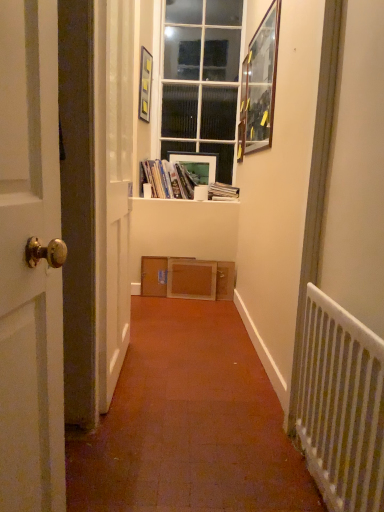
Question: Should I look upward or downward to see matte white picture frame at center, which ranks as the second picture frame in left-to-right order?

Choices:
 (A) up
 (B) down

Answer: (A)

Question: Considering the relative positions of hardcover book at center and wooden at center in the image provided, is hardcover book at center in front of wooden at center?

Choices:
 (A) yes
 (B) no

Answer: (B)

Question: Can you confirm if hardcover book at center is shorter than wooden at center?

Choices:
 (A) yes
 (B) no

Answer: (A)

Question: Does hardcover book at center have a greater height compared to wooden at center?

Choices:
 (A) yes
 (B) no

Answer: (B)

Question: Is hardcover book at center thinner than wooden at center?

Choices:
 (A) no
 (B) yes

Answer: (A)

Question: Is hardcover book at center positioned behind wooden at center?

Choices:
 (A) yes
 (B) no

Answer: (A)

Question: Can you confirm if hardcover book at center is wider than wooden at center?

Choices:
 (A) no
 (B) yes

Answer: (B)

Question: Is white glass window at center behind white metal radiator at right?

Choices:
 (A) yes
 (B) no

Answer: (A)

Question: Is white glass window at center facing away from white metal radiator at right?

Choices:
 (A) yes
 (B) no

Answer: (B)

Question: Is white glass window at center next to white metal radiator at right?

Choices:
 (A) no
 (B) yes

Answer: (A)

Question: Does white glass window at center have a lesser width compared to white metal radiator at right?

Choices:
 (A) no
 (B) yes

Answer: (A)

Question: From the image's perspective, is white glass window at center located beneath white metal radiator at right?

Choices:
 (A) no
 (B) yes

Answer: (A)

Question: From a real-world perspective, does white glass window at center stand above white metal radiator at right?

Choices:
 (A) no
 (B) yes

Answer: (B)

Question: Does white cardboard at center appear on the left side of hardcover book at center?

Choices:
 (A) no
 (B) yes

Answer: (B)